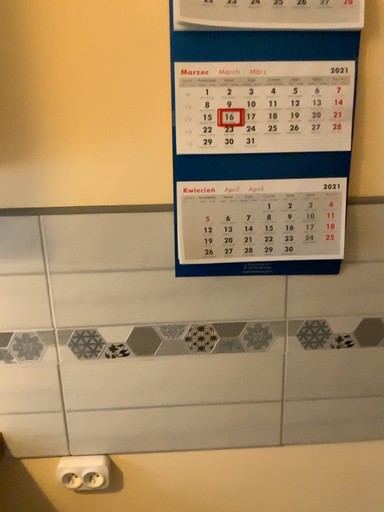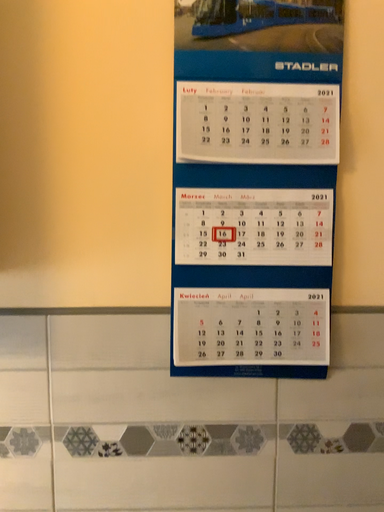
Question: How did the camera likely rotate when shooting the video?

Choices:
 (A) rotated downward
 (B) rotated upward

Answer: (B)